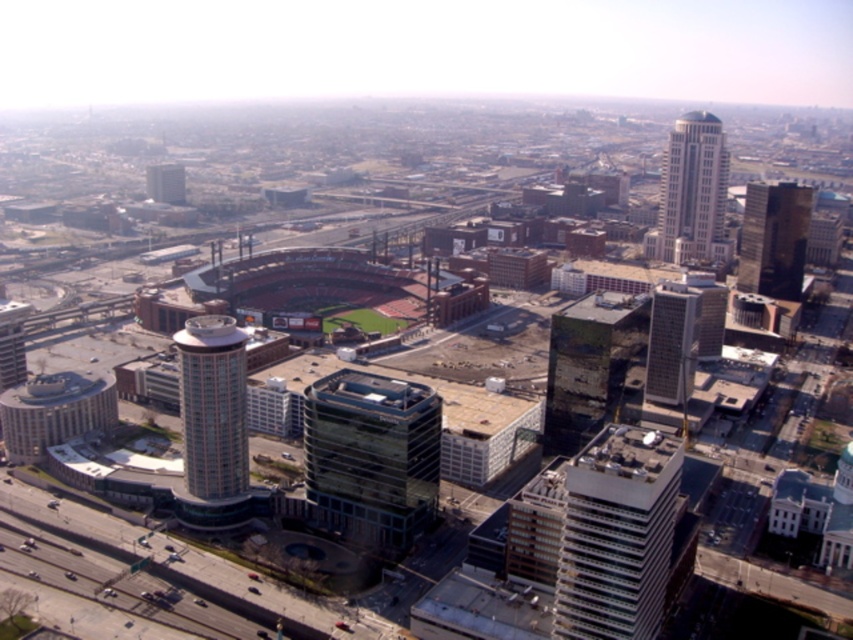
Question: Based on their relative distances, which object is nearer to the white glass skyscraper at upper right?

Choices:
 (A) rusty metal building at center
 (B) beige glass tower at center
 (C) dark glass skyscraper at right
 (D) white glass building at center-right

Answer: (C)

Question: Does white glass building at center-right appear on the left side of rusty metal building at center?

Choices:
 (A) yes
 (B) no

Answer: (A)

Question: Based on their relative distances, which object is farther from the white glass skyscraper at upper right?

Choices:
 (A) green glass skyscraper at center
 (B) white glass building at center-right
 (C) dark glass skyscraper at right
 (D) beige glass tower at center

Answer: (B)

Question: Considering the relative positions of beige glass tower at center and dark glass skyscraper at right in the image provided, where is beige glass tower at center located with respect to dark glass skyscraper at right?

Choices:
 (A) left
 (B) right

Answer: (A)

Question: In this image, where is dark glass skyscraper at right located relative to green glass skyscraper at center?

Choices:
 (A) right
 (B) left

Answer: (A)

Question: Based on their relative distances, which object is nearer to the green glass tower at lower left?

Choices:
 (A) dark glass skyscraper at right
 (B) white glass skyscraper at upper right

Answer: (B)